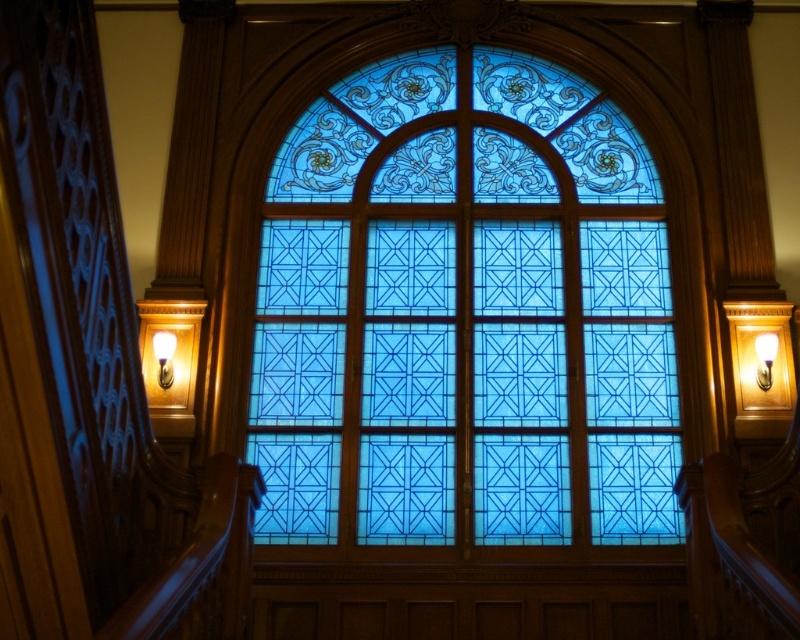
Question: Is blue stained glass at center positioned before matte white lamp at upper center?

Choices:
 (A) no
 (B) yes

Answer: (B)

Question: Is wooden handrail at left above white glossy wall sconce at upper center?

Choices:
 (A) no
 (B) yes

Answer: (B)

Question: Among these points, which one is farthest from the camera?

Choices:
 (A) (568, 257)
 (B) (168, 376)
 (C) (770, 333)

Answer: (A)

Question: Among these objects, which one is farthest from the camera?

Choices:
 (A) wooden handrail at left
 (B) white glossy wall sconce at upper center

Answer: (B)

Question: Which is nearer to the blue stained glass at center?

Choices:
 (A) white glossy wall sconce at upper center
 (B) wooden handrail at left
 (C) matte white lamp at upper center

Answer: (A)

Question: Does blue stained glass at center lie in front of white glossy wall sconce at upper center?

Choices:
 (A) yes
 (B) no

Answer: (A)